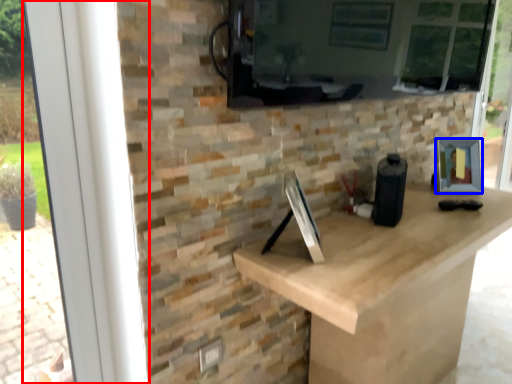
Question: Among these objects, which one is farthest to the camera, window frame (highlighted by a red box) or picture frame (highlighted by a blue box)?

Choices:
 (A) window frame
 (B) picture frame

Answer: (B)